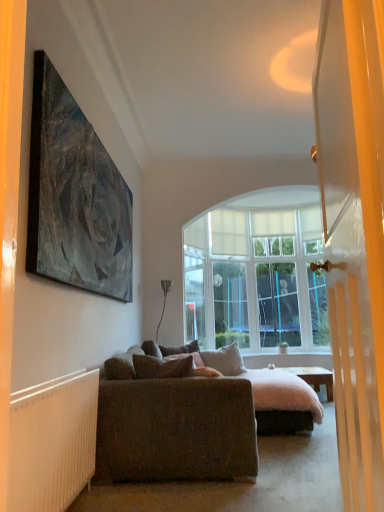
Question: From a real-world perspective, is dark gray matte painting at upper left on wooden desk at center?

Choices:
 (A) yes
 (B) no

Answer: (A)

Question: Is dark gray matte painting at upper left positioned with its back to wooden desk at center?

Choices:
 (A) yes
 (B) no

Answer: (B)

Question: Would you say dark gray matte painting at upper left is outside wooden desk at center?

Choices:
 (A) yes
 (B) no

Answer: (A)

Question: Are dark gray matte painting at upper left and wooden desk at center far apart?

Choices:
 (A) no
 (B) yes

Answer: (B)

Question: Is dark gray matte painting at upper left wider than wooden desk at center?

Choices:
 (A) no
 (B) yes

Answer: (A)

Question: Would you say dark gray matte painting at upper left is to the left or to the right of white ribbed radiator at lower left in the picture?

Choices:
 (A) right
 (B) left

Answer: (B)

Question: Relative to white ribbed radiator at lower left, is dark gray matte painting at upper left in front or behind?

Choices:
 (A) front
 (B) behind

Answer: (B)

Question: In terms of height, does dark gray matte painting at upper left look taller or shorter compared to white ribbed radiator at lower left?

Choices:
 (A) tall
 (B) short

Answer: (A)

Question: From a real-world perspective, is dark gray matte painting at upper left above or below white ribbed radiator at lower left?

Choices:
 (A) below
 (B) above

Answer: (B)

Question: Based on their positions, is velvet purple pillow at center, marked as the 1th pillow in a back-to-front arrangement, located to the left or right of wooden desk at center?

Choices:
 (A) right
 (B) left

Answer: (B)

Question: From a real-world perspective, is velvet purple pillow at center, placed as the third pillow when sorted from front to back, above or below wooden desk at center?

Choices:
 (A) above
 (B) below

Answer: (A)

Question: Does point (195, 346) appear closer or farther from the camera than point (327, 391)?

Choices:
 (A) closer
 (B) farther

Answer: (A)

Question: From the image's perspective, is velvet purple pillow at center, marked as the 1th pillow in a back-to-front arrangement, located above or below wooden desk at center?

Choices:
 (A) above
 (B) below

Answer: (A)

Question: Which is correct: wooden desk at center is inside velvet purple pillow at center, marked as the 1th pillow in a back-to-front arrangement, or outside of it?

Choices:
 (A) outside
 (B) inside

Answer: (A)

Question: Is point (331, 374) closer or farther from the camera than point (195, 351)?

Choices:
 (A) farther
 (B) closer

Answer: (A)